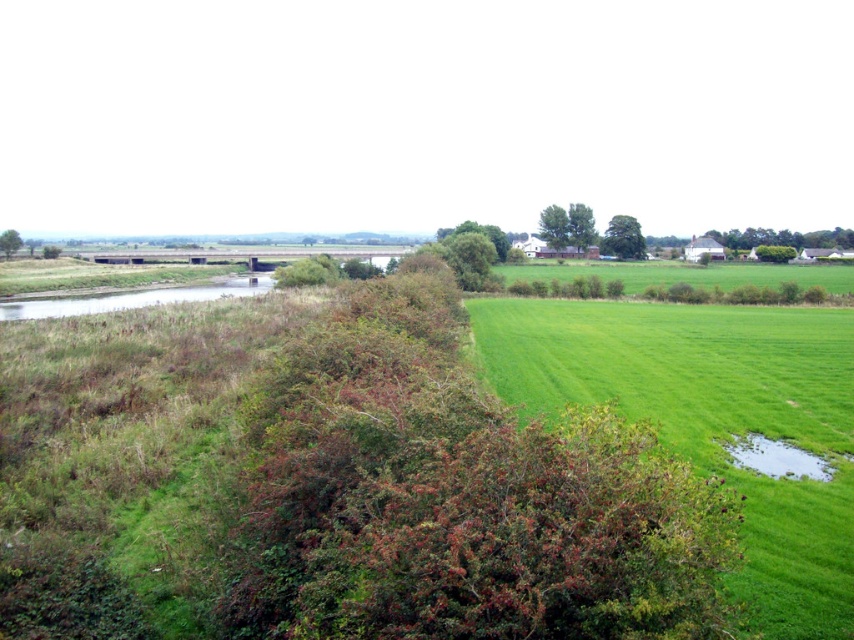
Is green grass at center wider than green grassy waterway at lower left?

Correct, the width of green grass at center exceeds that of green grassy waterway at lower left.

The height and width of the screenshot is (640, 854). What do you see at coordinates (711, 420) in the screenshot?
I see `green grass at center` at bounding box center [711, 420].

Locate an element on the screen. The height and width of the screenshot is (640, 854). green grass at center is located at coordinates (711, 420).